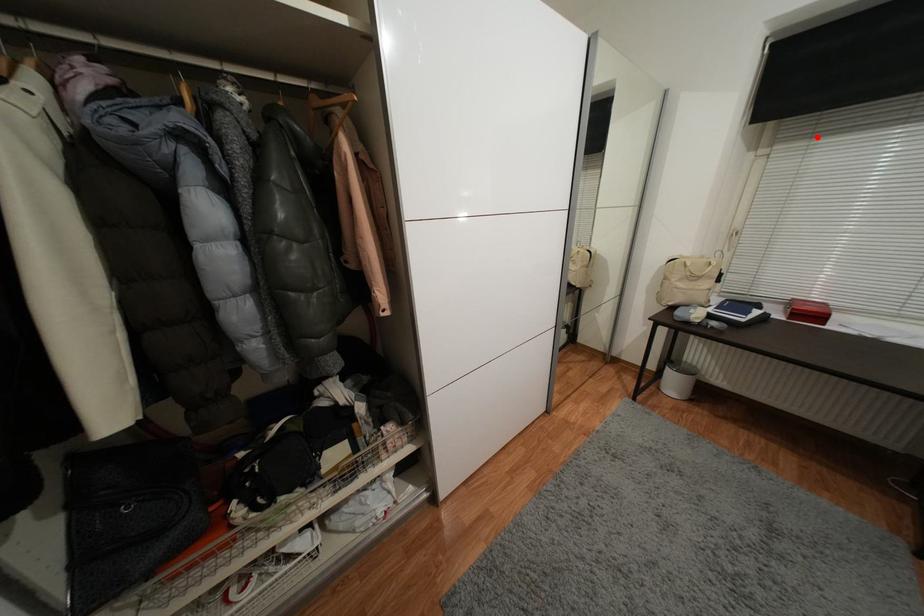
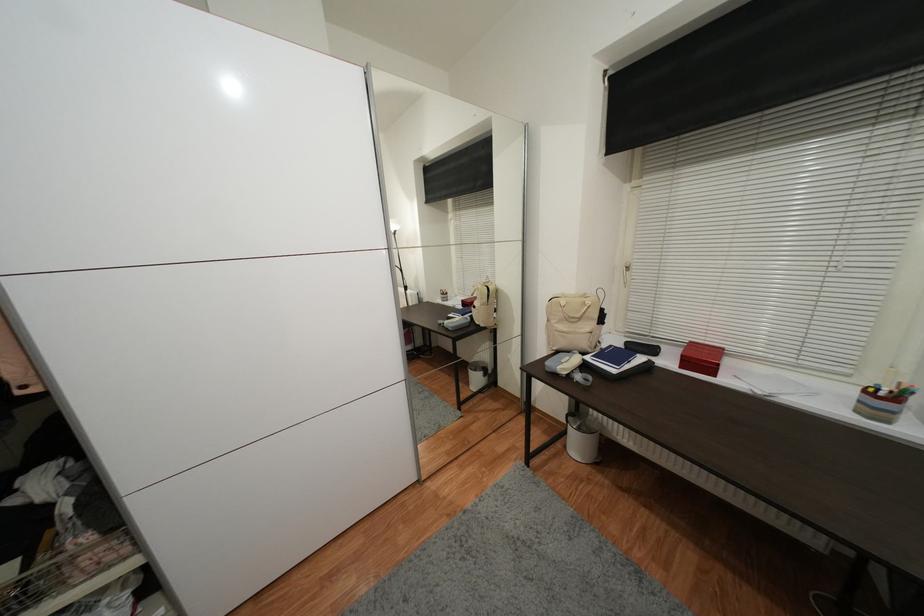
Find the pixel in the second image that matches the highlighted location in the first image.

(678, 167)